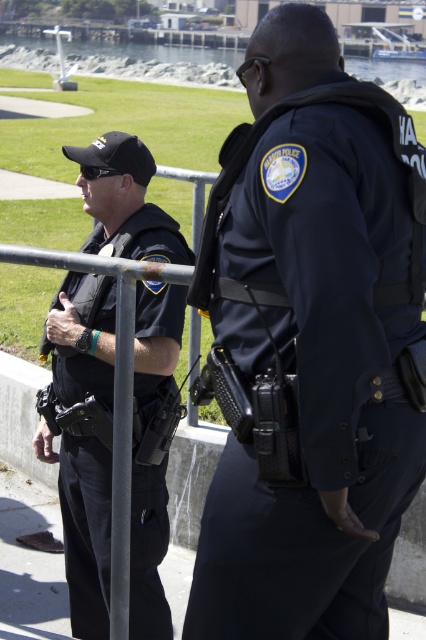
Question: Does dark blue uniform at center appear on the right side of metallic gray pole at center?

Choices:
 (A) no
 (B) yes

Answer: (B)

Question: Estimate the real-world distances between objects in this image. Which object is farther from the black matte uniform at center?

Choices:
 (A) metallic gray pole at center
 (B) dark blue uniform at center

Answer: (B)

Question: Is dark blue uniform at center wider than metallic gray pole at center?

Choices:
 (A) no
 (B) yes

Answer: (B)

Question: Among these points, which one is farthest from the camera?

Choices:
 (A) (57, 294)
 (B) (385, 624)
 (C) (126, 492)

Answer: (A)

Question: Where is black matte uniform at center located in relation to metallic gray pole at center in the image?

Choices:
 (A) below
 (B) above

Answer: (B)

Question: Which of these objects is positioned farthest from the black matte uniform at center?

Choices:
 (A) metallic gray pole at center
 (B) dark blue uniform at center

Answer: (B)